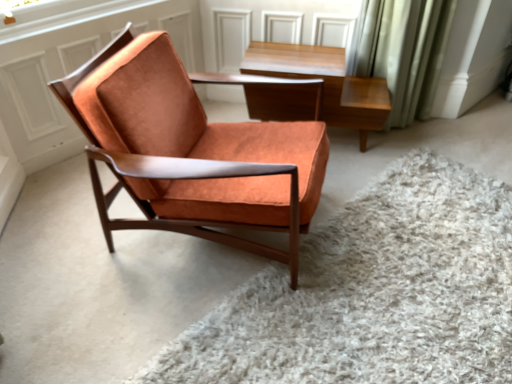
Question: From the image's perspective, is orange suede chair at center located beneath suede orange chair at center?

Choices:
 (A) no
 (B) yes

Answer: (B)

Question: Considering the relative sizes of orange suede chair at center and suede orange chair at center in the image provided, is orange suede chair at center shorter than suede orange chair at center?

Choices:
 (A) no
 (B) yes

Answer: (B)

Question: Can you confirm if orange suede chair at center is bigger than suede orange chair at center?

Choices:
 (A) yes
 (B) no

Answer: (B)

Question: From a real-world perspective, is orange suede chair at center physically above suede orange chair at center?

Choices:
 (A) yes
 (B) no

Answer: (B)

Question: Are orange suede chair at center and suede orange chair at center far apart?

Choices:
 (A) yes
 (B) no

Answer: (B)

Question: In the image, is light brown wood table at upper center on the left side or the right side of orange suede chair at center?

Choices:
 (A) left
 (B) right

Answer: (A)

Question: Would you say light brown wood table at upper center is inside or outside orange suede chair at center?

Choices:
 (A) inside
 (B) outside

Answer: (B)

Question: Is light brown wood table at upper center in front of or behind orange suede chair at center in the image?

Choices:
 (A) behind
 (B) front

Answer: (A)

Question: From a real-world perspective, is light brown wood table at upper center positioned above or below orange suede chair at center?

Choices:
 (A) below
 (B) above

Answer: (B)

Question: Considering the positions of suede orange chair at center and orange suede chair at center in the image, is suede orange chair at center wider or thinner than orange suede chair at center?

Choices:
 (A) thin
 (B) wide

Answer: (A)

Question: Does point (230, 173) appear closer or farther from the camera than point (384, 292)?

Choices:
 (A) closer
 (B) farther

Answer: (A)

Question: Is suede orange chair at center in front of or behind orange suede chair at center in the image?

Choices:
 (A) behind
 (B) front

Answer: (A)

Question: From a real-world perspective, is suede orange chair at center physically located above or below orange suede chair at center?

Choices:
 (A) below
 (B) above

Answer: (B)

Question: Based on their positions, is orange suede chair at center located to the left or right of suede orange chair at center?

Choices:
 (A) left
 (B) right

Answer: (B)

Question: From the image's perspective, is orange suede chair at center located above or below suede orange chair at center?

Choices:
 (A) above
 (B) below

Answer: (B)